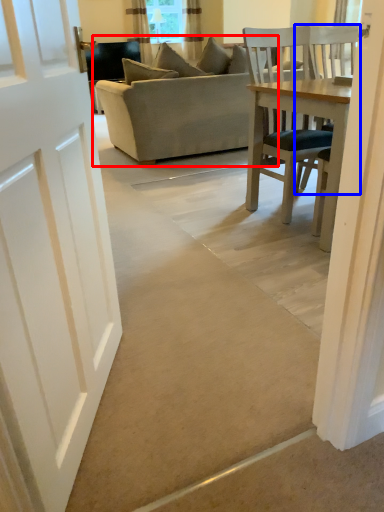
Question: Which point is further to the camera, studio couch (highlighted by a red box) or chair (highlighted by a blue box)?

Choices:
 (A) studio couch
 (B) chair

Answer: (A)